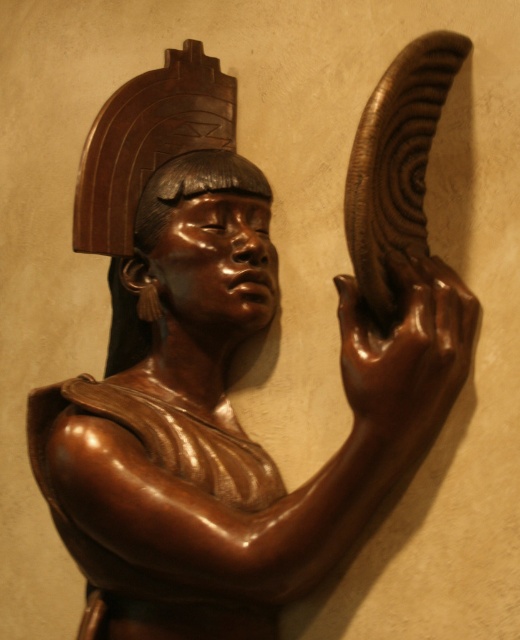
You are an art conservator examining the sculpture. You notice the shiny brown hand at upper right and the matte brown head at center. Which object is closer to you, the viewer?

The shiny brown hand at upper right is closer to the viewer because it is in front of the matte brown head at center.

In the scene shown: You are a photographer standing 2 meters away from the wooden sculpture. You want to take a closeup shot of the point at coordinates point [381,413]. Can you reach the point with your camera without moving closer than 2 meters?

The point [381,413] is 1.33 meters from the camera, so yes, you can take a closeup shot of the point at coordinates point 0.648, 0.633 without moving closer than 2 meters because the point is within the camera distance.

You are a photographer standing at the camera position. You want to take a closeup photo of the shiny brown hand at upper right. Can you move closer to the hand to get a better shot without exceeding the 1.5 meters safety distance limit?

The distance between the shiny brown hand at upper right and the camera is 1.31 meters, which is within the 1.5 meters safety limit. Therefore, you can move closer to the shiny brown hand at upper right to take the closeup photo.